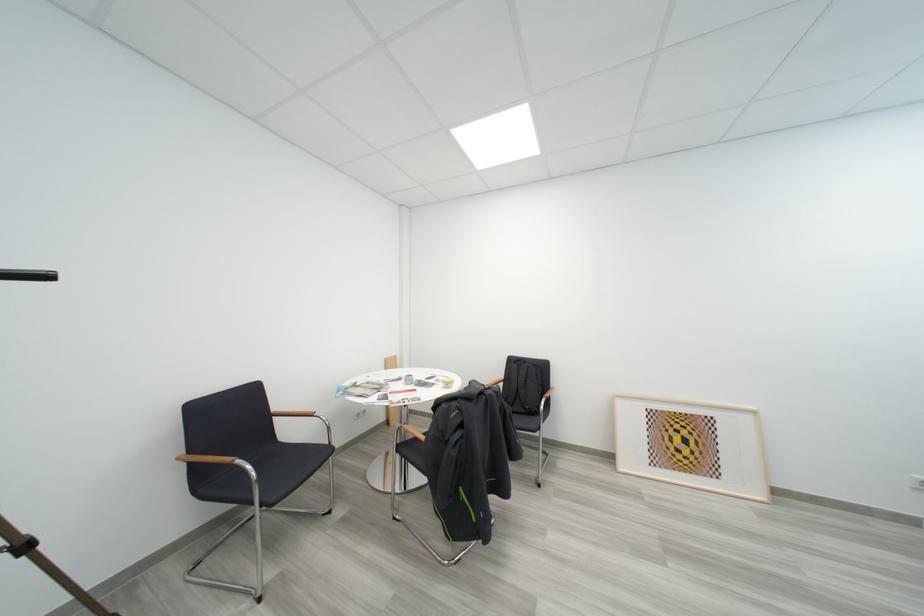
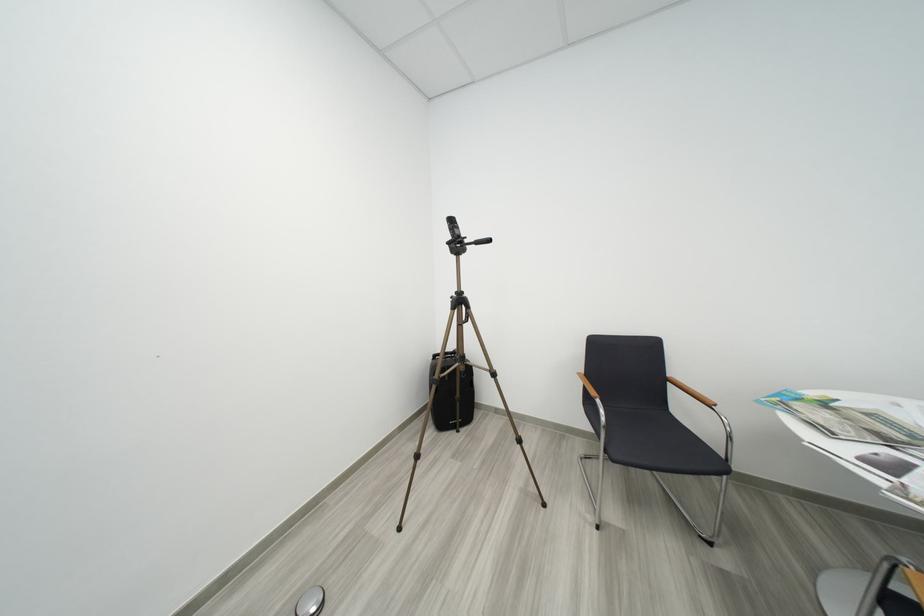
Question: The images are taken continuously from a first-person perspective. In which direction is your viewpoint rotating?

Choices:
 (A) Left
 (B) Right
 (C) Up
 (D) Down

Answer: (A)